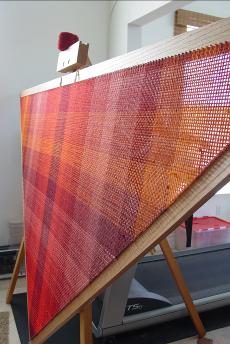
Find the location of `window through fabric`. window through fabric is located at coordinates (203, 67).